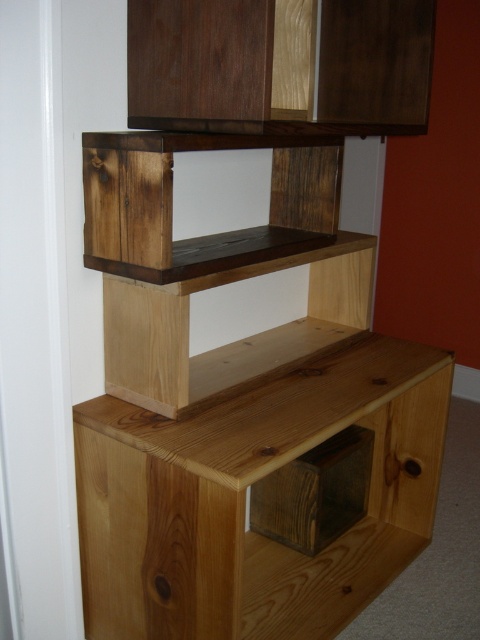
Is rustic wood shelf at center further to camera compared to natural wood shelf at center?

No, it is not.

Is point (134, 236) in front of point (237, 385)?

That is True.

Find the location of a particular element. rustic wood shelf at center is located at coordinates (171, 204).

Which is below, dark brown wood cabinet at upper center or natural wood shelf at center?

Positioned lower is natural wood shelf at center.

Which of these two, dark brown wood cabinet at upper center or natural wood shelf at center, stands taller?

dark brown wood cabinet at upper center

You are a GUI agent. You are given a task and a screenshot of the screen. Output one action in this format:
    pyautogui.click(x=<x>, y=<y>)
    Task: Click on the dark brown wood cabinet at upper center
    
    Given the screenshot: What is the action you would take?
    pyautogui.click(x=200, y=65)

Locate an element on the screen. This screenshot has width=480, height=640. dark brown wood cabinet at upper center is located at coordinates (200, 65).

Is natural wood drawer at lower center positioned at the back of rustic wood shelf at center?

No, natural wood drawer at lower center is closer to the viewer.

Based on the photo, does natural wood drawer at lower center have a larger size compared to rustic wood shelf at center?

Correct, natural wood drawer at lower center is larger in size than rustic wood shelf at center.

Image resolution: width=480 pixels, height=640 pixels. Describe the element at coordinates (244, 499) in the screenshot. I see `natural wood drawer at lower center` at that location.

Find the location of a particular element. natural wood drawer at lower center is located at coordinates (244, 499).